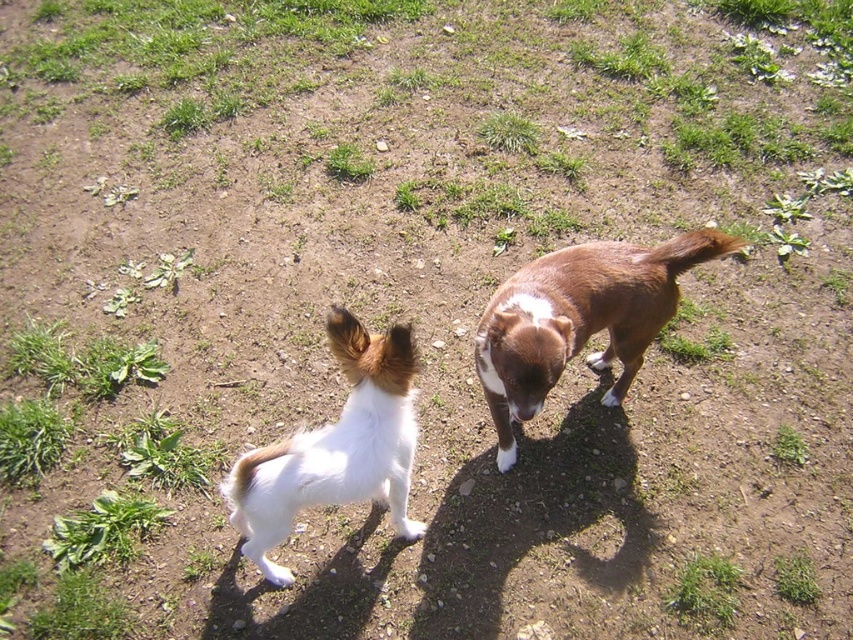
You are a photographer setting up a tripod in the grassy area. You want to place the tripod so that it is between the white fluffy dog at center and the green leafy grass at lower left. Is this possible?

The white fluffy dog at center is located below the green leafy grass at lower left, so placing the tripod between them would require positioning it in the space between the lower position of the white fluffy dog at center and the higher position of the green leafy grass at lower left. This is feasible as long as there is enough space between their positions.

You are a gardener who wants to plant a new flower bed. You have two spots to choose from in the image. One is near the green leafy grass at lower left and the other is near the green soft grass at center. Which spot has thicker grass, making it better for planting?

The green soft grass at center is thicker than the green leafy grass at lower left, so it would be better for planting.